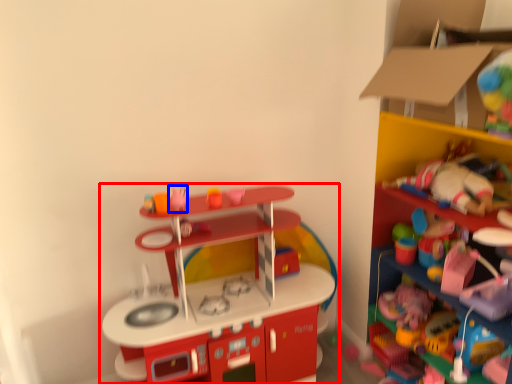
Question: Which object is further to the camera taking this photo, toy (highlighted by a red box) or toy (highlighted by a blue box)?

Choices:
 (A) toy
 (B) toy

Answer: (B)